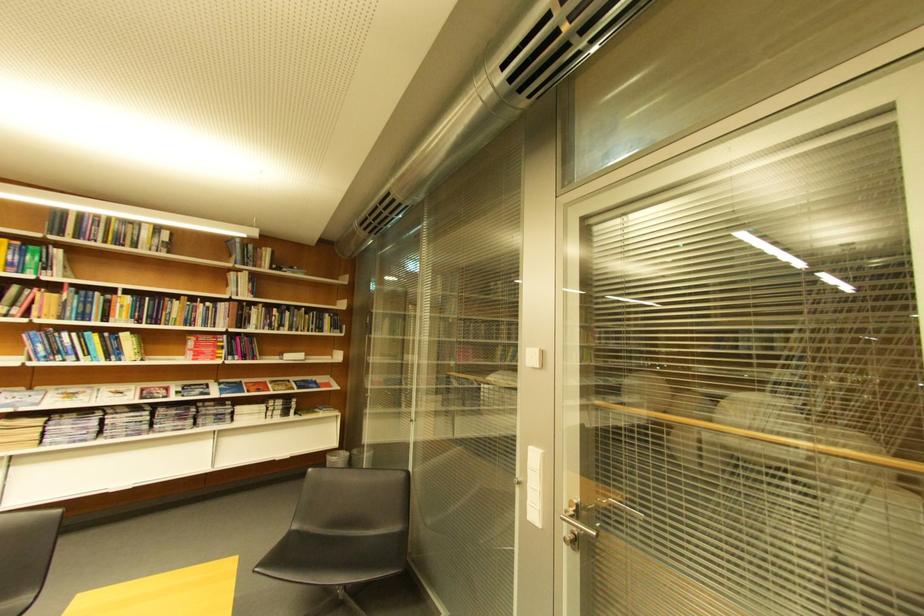
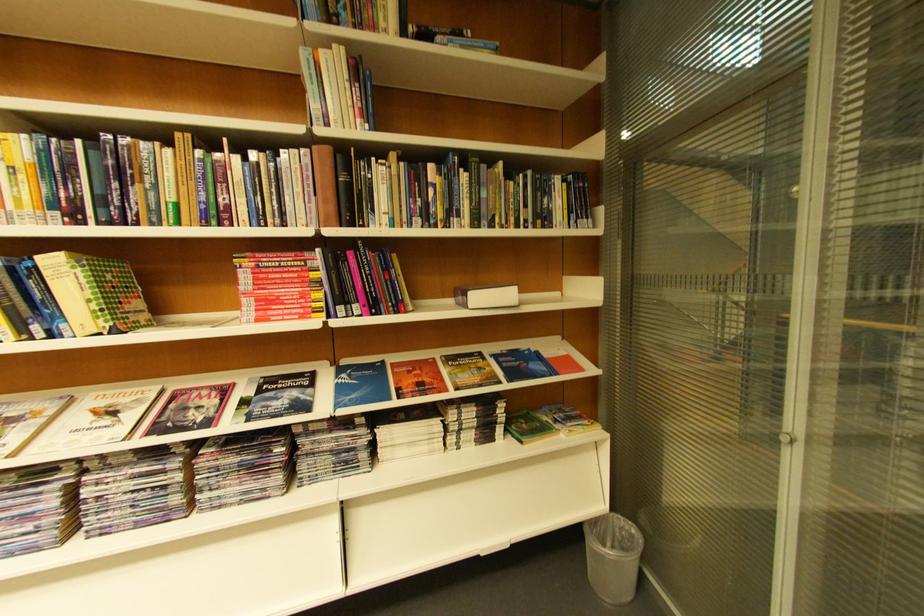
The images are taken continuously from a first-person perspective. In which direction are you moving?

The movement direction of the cameraman is left, forward.